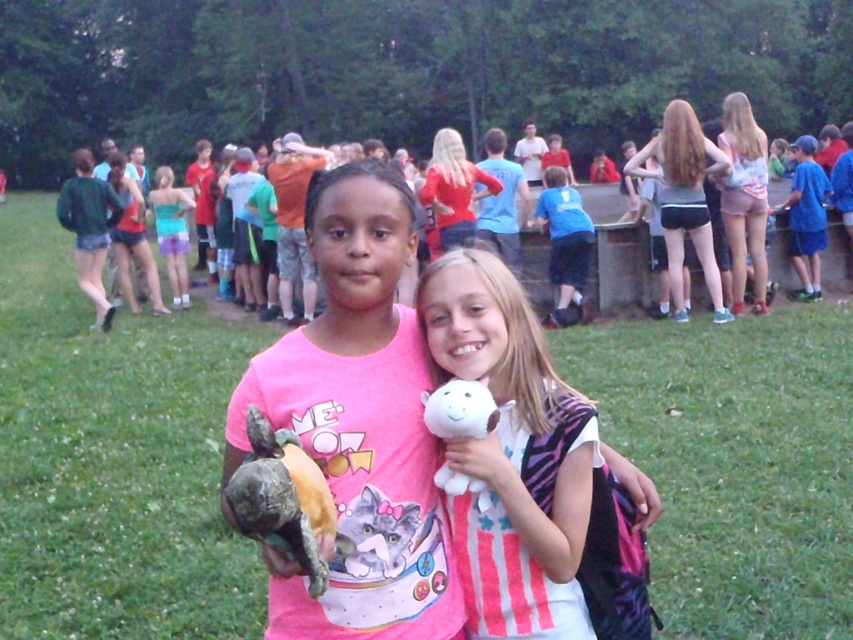
You are a photographer trying to capture a photo of the green matte jacket at left and the blue cotton shirt at right. Based on their positions, which one is higher in the frame?

The green matte jacket at left is above the blue cotton shirt at right, so it is higher in the frame.

You are a photographer setting up a camera to capture the two girls in the scene. You need to ensure both the green matte jacket at left and the blue cotton shirt at right are fully visible in the frame. Based on their positions and sizes, which clothing item requires more horizontal space in the frame?

The green matte jacket at left requires more horizontal space in the frame because it might be wider than the blue cotton shirt at right.